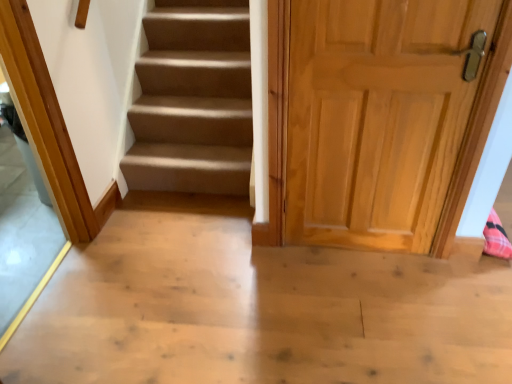
What are the coordinates of `empty space that is in between light brown wood door at right and transparent glass door at left` in the screenshot? It's located at (186, 284).